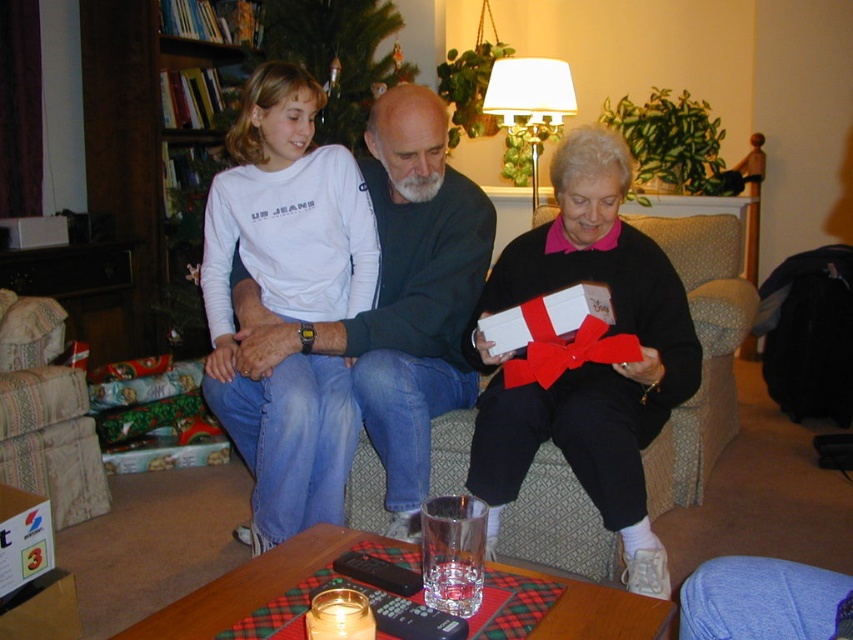
Question: Can you confirm if matte white gift box at center is positioned above dark gray sweater at center?

Choices:
 (A) yes
 (B) no

Answer: (B)

Question: Does matte white gift box at center appear over matte black sweater at center?

Choices:
 (A) yes
 (B) no

Answer: (B)

Question: Which is farther from the white cotton shirt at upper left?

Choices:
 (A) blue fabric at lower right
 (B) patterned fabric armchair at lower left
 (C) matte black sweater at center
 (D) dark gray sweater at center

Answer: (A)

Question: Which point is farther to the camera?

Choices:
 (A) matte white gift box at center
 (B) matte black sweater at center

Answer: (B)

Question: Does patterned fabric armchair at lower left appear over blue fabric at lower right?

Choices:
 (A) yes
 (B) no

Answer: (A)

Question: Which point is closer to the camera taking this photo?

Choices:
 (A) (590, 433)
 (B) (13, 342)
 (C) (462, 180)
 (D) (306, 282)

Answer: (A)